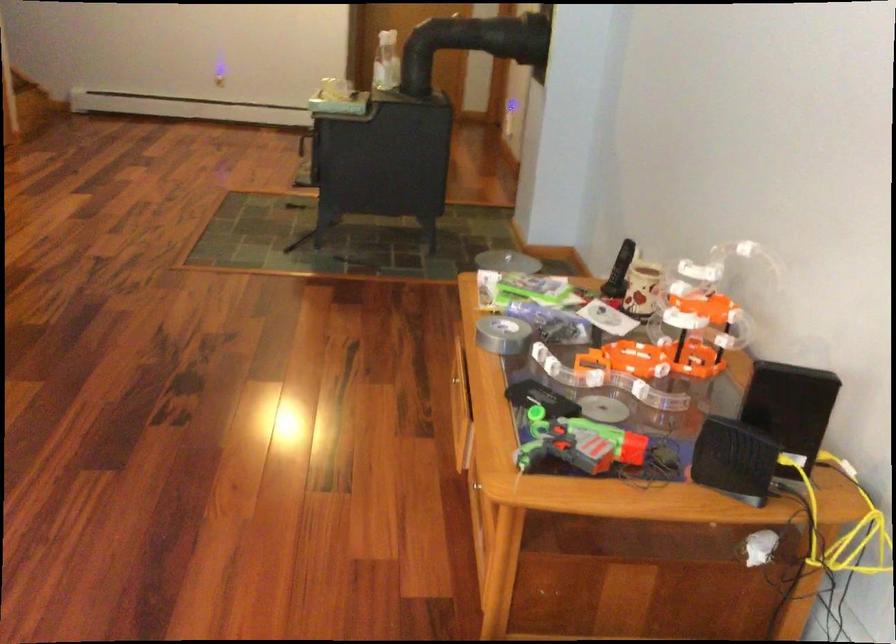
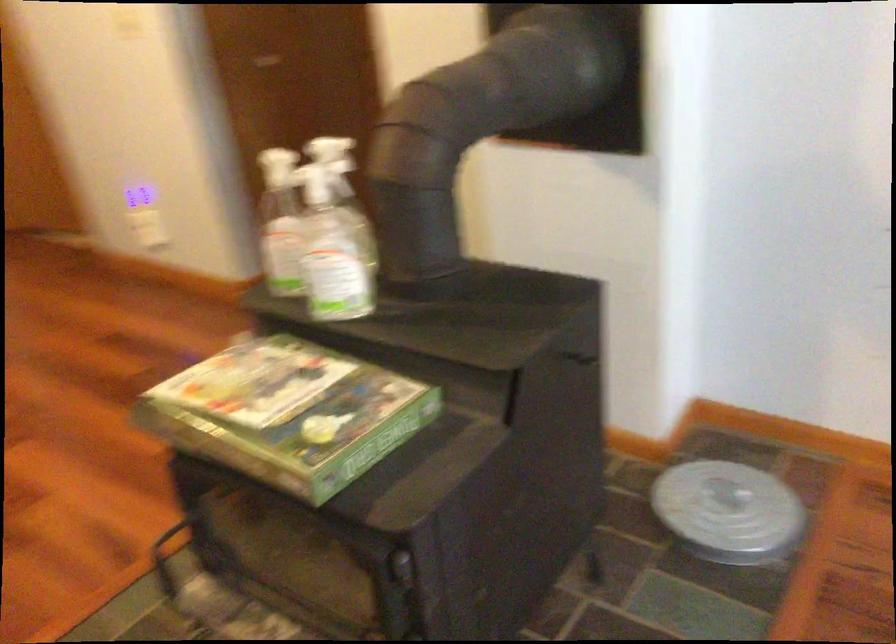
Find the pixel in the second image that matches [489,259] in the first image.

(728, 512)